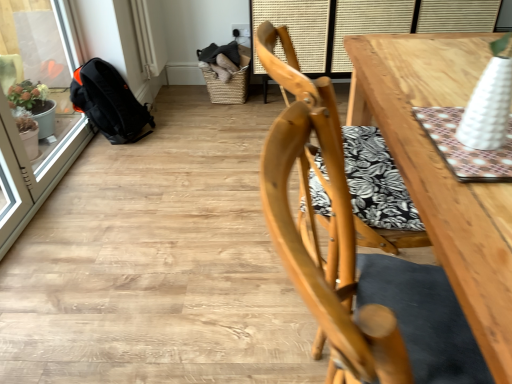
Identify the location of vacant region to the left of light wood chair at center. Image resolution: width=512 pixels, height=384 pixels. (202, 295).